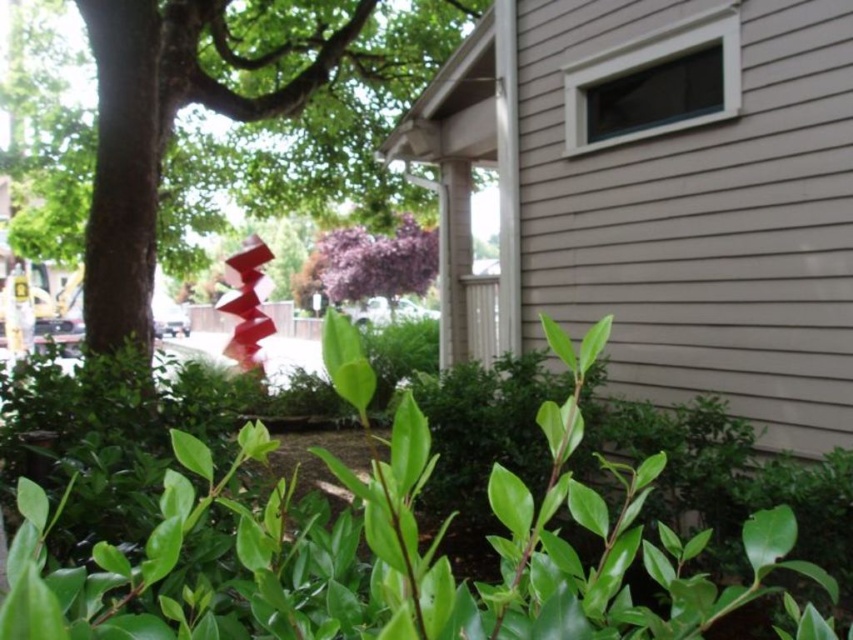
Between green glossy hedge at lower center and green leafy tree at center, which one appears on the right side from the viewer's perspective?

Positioned to the right is green glossy hedge at lower center.

Does green glossy hedge at lower center have a smaller size compared to green leafy tree at center?

No, green glossy hedge at lower center is not smaller than green leafy tree at center.

Which is behind, point (143, 634) or point (173, 227)?

The point (173, 227) is more distant.

Find the location of a particular element. This screenshot has width=853, height=640. green glossy hedge at lower center is located at coordinates (399, 550).

Is point (172, 620) positioned after point (424, 289)?

No, it is in front of (424, 289).

Who is positioned more to the left, green glossy hedge at lower center or purple matte flower at center?

purple matte flower at center is more to the left.

The width and height of the screenshot is (853, 640). I want to click on green glossy hedge at lower center, so click(399, 550).

Is point (252, 22) in front of point (437, 236)?

That is True.

The width and height of the screenshot is (853, 640). In order to click on green leafy tree at center in this screenshot , I will do `click(224, 129)`.